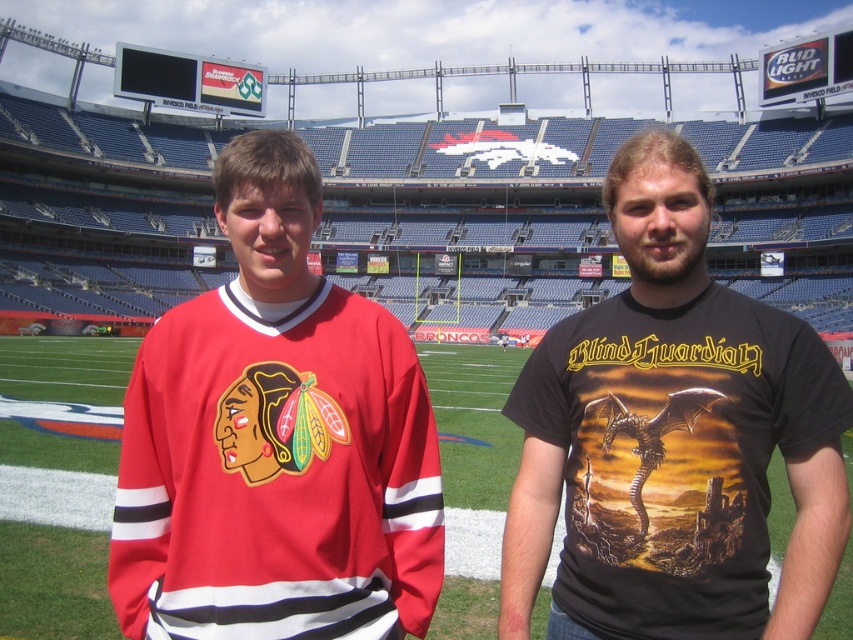
Question: Which point is closer to the camera?

Choices:
 (A) black matte t-shirt at center
 (B) matte jersey at center

Answer: (A)

Question: Which point is closer to the camera taking this photo?

Choices:
 (A) (47, 627)
 (B) (654, 346)

Answer: (B)

Question: Is matte jersey at center below black matte t-shirt at center?

Choices:
 (A) no
 (B) yes

Answer: (B)

Question: Which of the following is the farthest from the observer?

Choices:
 (A) (103, 394)
 (B) (265, 582)
 (C) (775, 346)

Answer: (A)

Question: Can you confirm if matte jersey at center is positioned below black matte t-shirt at center?

Choices:
 (A) yes
 (B) no

Answer: (A)

Question: Considering the relative positions of matte jersey at center and black matte t-shirt at center in the image provided, where is matte jersey at center located with respect to black matte t-shirt at center?

Choices:
 (A) right
 (B) left

Answer: (B)